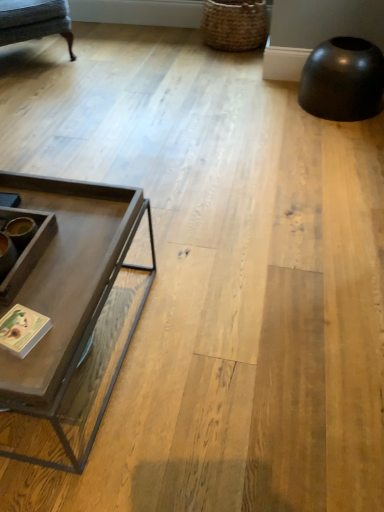
Question: Is textured gray fabric swivel chair at upper left facing away from woven brown basket at upper right?

Choices:
 (A) yes
 (B) no

Answer: (B)

Question: Is textured gray fabric swivel chair at upper left positioned beyond the bounds of woven brown basket at upper right?

Choices:
 (A) no
 (B) yes

Answer: (B)

Question: Can you confirm if textured gray fabric swivel chair at upper left is thinner than woven brown basket at upper right?

Choices:
 (A) no
 (B) yes

Answer: (A)

Question: Is textured gray fabric swivel chair at upper left not close to woven brown basket at upper right?

Choices:
 (A) yes
 (B) no

Answer: (A)

Question: Could you tell me if textured gray fabric swivel chair at upper left is facing woven brown basket at upper right?

Choices:
 (A) yes
 (B) no

Answer: (B)

Question: In the image, is woven brown basket at upper right positioned in front of or behind textured gray fabric swivel chair at upper left?

Choices:
 (A) behind
 (B) front

Answer: (A)

Question: In terms of height, does woven brown basket at upper right look taller or shorter compared to textured gray fabric swivel chair at upper left?

Choices:
 (A) short
 (B) tall

Answer: (A)

Question: From a real-world perspective, is woven brown basket at upper right positioned above or below textured gray fabric swivel chair at upper left?

Choices:
 (A) below
 (B) above

Answer: (A)

Question: Considering the positions of point (220, 15) and point (16, 1), is point (220, 15) closer or farther from the camera than point (16, 1)?

Choices:
 (A) farther
 (B) closer

Answer: (A)

Question: From a real-world perspective, is matte gray coffee table at left positioned above or below textured gray fabric swivel chair at upper left?

Choices:
 (A) below
 (B) above

Answer: (A)

Question: Would you say matte gray coffee table at left is inside or outside textured gray fabric swivel chair at upper left?

Choices:
 (A) inside
 (B) outside

Answer: (B)

Question: From their relative heights in the image, would you say matte gray coffee table at left is taller or shorter than textured gray fabric swivel chair at upper left?

Choices:
 (A) short
 (B) tall

Answer: (A)

Question: Would you say matte gray coffee table at left is to the left or to the right of textured gray fabric swivel chair at upper left in the picture?

Choices:
 (A) right
 (B) left

Answer: (A)

Question: Choose the correct answer: Is textured gray fabric swivel chair at upper left inside woven brown basket at upper right or outside it?

Choices:
 (A) outside
 (B) inside

Answer: (A)

Question: Is textured gray fabric swivel chair at upper left in front of or behind woven brown basket at upper right in the image?

Choices:
 (A) front
 (B) behind

Answer: (A)